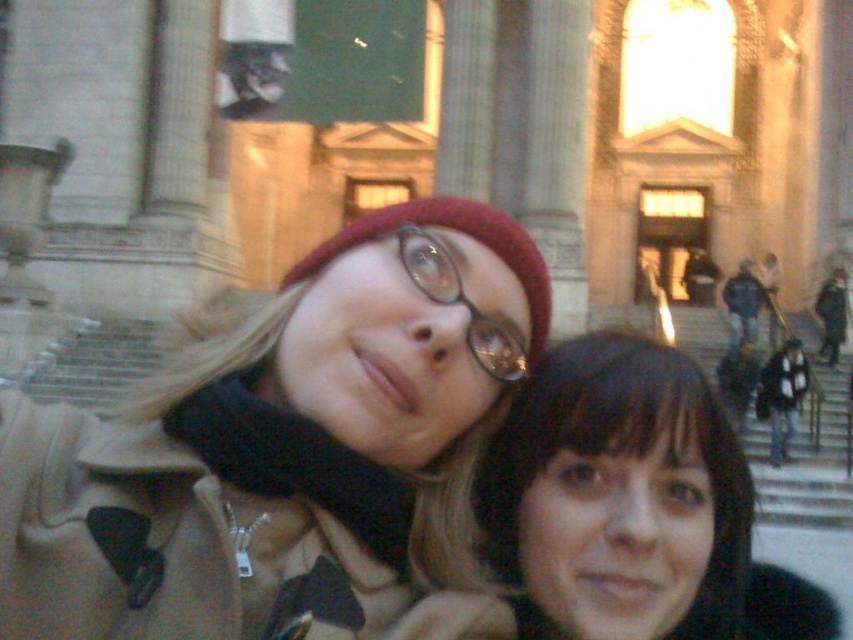
Does black matte hair at lower right appear on the right side of clear plastic glasses at center?

Indeed, black matte hair at lower right is positioned on the right side of clear plastic glasses at center.

Between black matte hair at lower right and clear plastic glasses at center, which one has more height?

Standing taller between the two is black matte hair at lower right.

Measure the distance between point (x=596, y=452) and camera.

Point (x=596, y=452) is 37.29 meters from camera.

At what (x,y) coordinates should I click in order to perform the action: click on black matte hair at lower right. Please return your answer as a coordinate pair (x, y). Image resolution: width=853 pixels, height=640 pixels. Looking at the image, I should click on (622, 497).

Can you confirm if matte beige coat at center is bigger than clear plastic glasses at center?

Yes.

Describe the element at coordinates (288, 452) in the screenshot. I see `matte beige coat at center` at that location.

The height and width of the screenshot is (640, 853). Describe the element at coordinates (288, 452) in the screenshot. I see `matte beige coat at center` at that location.

The width and height of the screenshot is (853, 640). Identify the location of matte beige coat at center. (288, 452).

Which is more to the right, matte beige coat at center or black matte hair at lower right?

black matte hair at lower right

Does matte beige coat at center appear on the left side of black matte hair at lower right?

Indeed, matte beige coat at center is positioned on the left side of black matte hair at lower right.

Does point (312, 604) lie behind point (625, 588)?

No, it is in front of (625, 588).

You are a GUI agent. You are given a task and a screenshot of the screen. Output one action in this format:
    pyautogui.click(x=<x>, y=<y>)
    Task: Click on the matte beige coat at center
    The width and height of the screenshot is (853, 640).
    Given the screenshot: What is the action you would take?
    pyautogui.click(x=288, y=452)